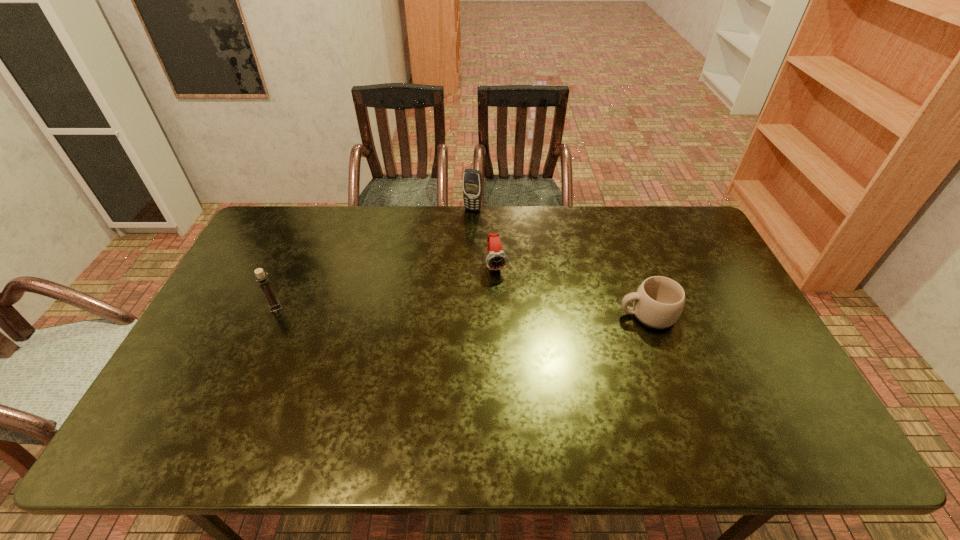
This screenshot has width=960, height=540. Find the location of `free space at the left edge`. free space at the left edge is located at coordinates (284, 271).

Where is `free space at the right edge of the desktop`? free space at the right edge of the desktop is located at coordinates (739, 372).

Image resolution: width=960 pixels, height=540 pixels. What are the coordinates of `vacant position at the far left corner of the desktop` in the screenshot? It's located at (270, 226).

The image size is (960, 540). What are the coordinates of `vacant region at the far right corner of the desktop` in the screenshot? It's located at (668, 209).

You are a GUI agent. You are given a task and a screenshot of the screen. Output one action in this format:
    pyautogui.click(x=<x>, y=<y>)
    Task: Click on the vacant point located between the candle holder and the watch
    The image size is (960, 540).
    Given the screenshot: What is the action you would take?
    pyautogui.click(x=386, y=286)

The width and height of the screenshot is (960, 540). Identify the location of vacant space in between the third object from left to right and the mug. (572, 289).

I want to click on free spot between the watch and the rightmost object, so click(572, 289).

Find the location of a particular element. This screenshot has height=540, width=960. free space between the mug and the watch is located at coordinates (572, 289).

You are a GUI agent. You are given a task and a screenshot of the screen. Output one action in this format:
    pyautogui.click(x=<x>, y=<y>)
    Task: Click on the vacant space that is in between the third object from left to right and the mug
    
    Given the screenshot: What is the action you would take?
    pyautogui.click(x=572, y=289)

Locate an element on the screen. This screenshot has width=960, height=540. free space between the cellular telephone and the second farthest object is located at coordinates (485, 237).